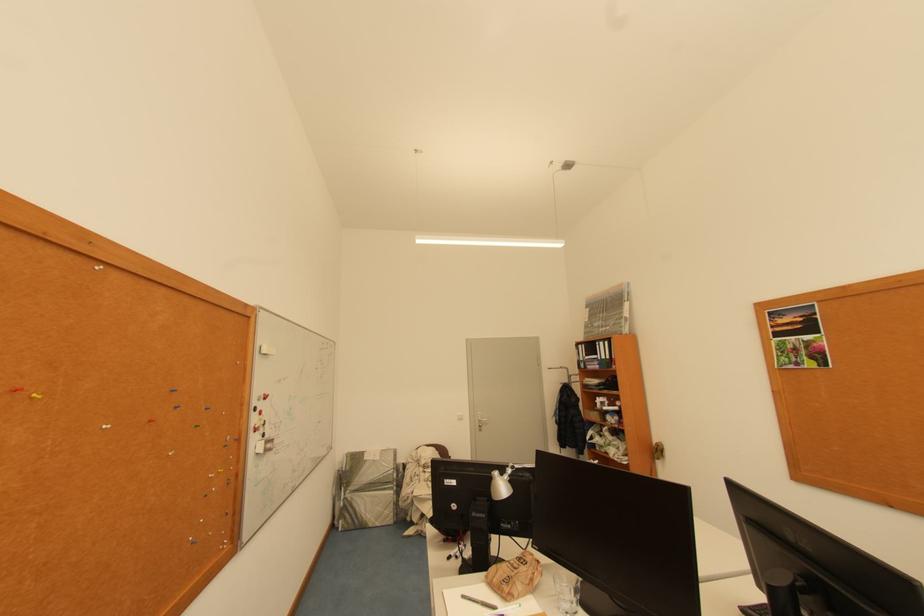
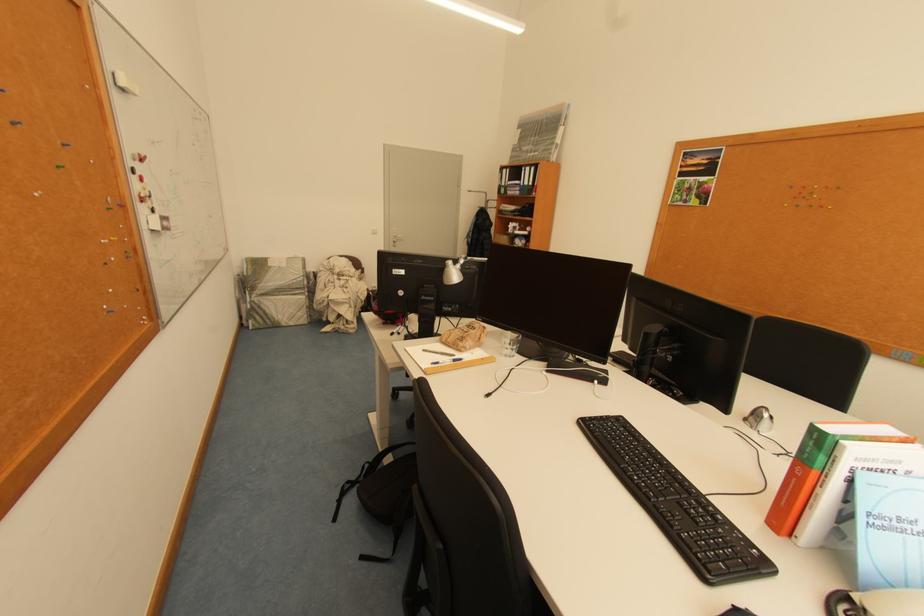
The point at (532, 560) is marked in the first image. Where is the corresponding point in the second image?

(481, 328)